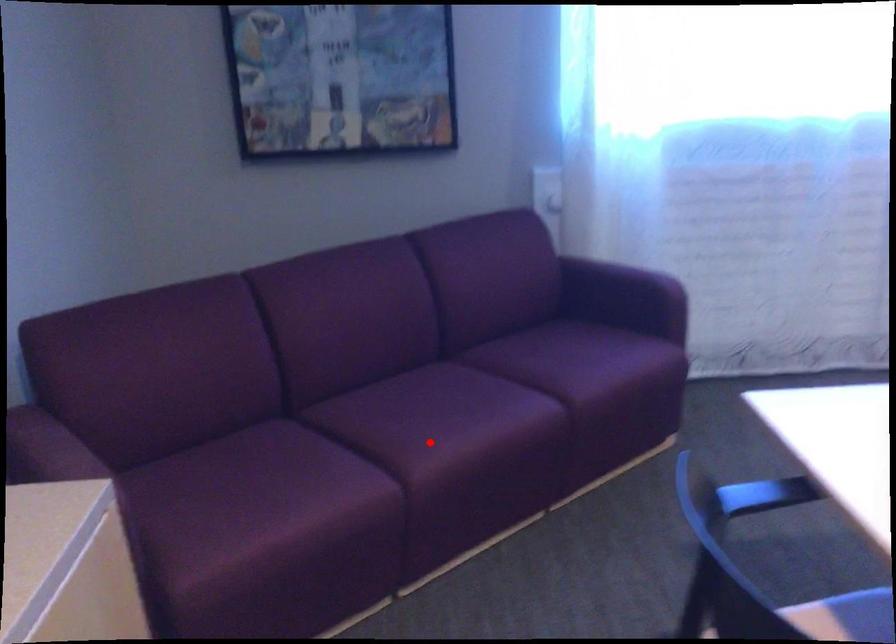
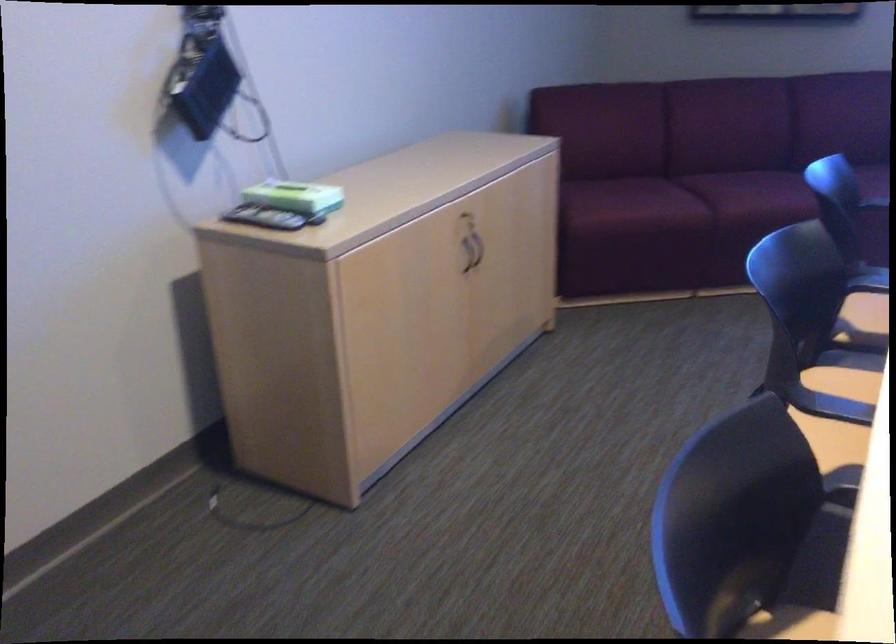
In the second image, find the point that corresponds to the highlighted location in the first image.

(745, 198)